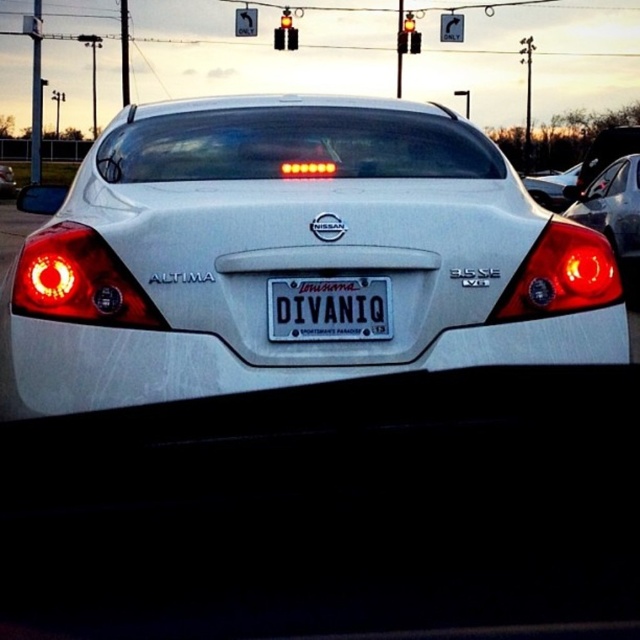
Question: Considering the real-world distances, which object is closest to the satin black sedan at center?

Choices:
 (A) matte plastic brake light at right
 (B) white plastic license plate at center
 (C) matte red brake light at left
 (D) satin silver sedan at center

Answer: (A)

Question: Does matte plastic brake light at center appear over red glass traffic light at center?

Choices:
 (A) yes
 (B) no

Answer: (B)

Question: Which object appears closest to the camera in this image?

Choices:
 (A) satin silver sedan at center
 (B) white plastic license plate at center
 (C) matte plastic brake light at center
 (D) red glass traffic light at upper center

Answer: (B)

Question: Observing the image, what is the correct spatial positioning of matte plastic brake light at center in reference to satin black sedan at center?

Choices:
 (A) left
 (B) right

Answer: (A)

Question: In this image, where is matte plastic brake light at right located relative to red glass traffic light at upper center?

Choices:
 (A) left
 (B) right

Answer: (B)

Question: Estimate the real-world distances between objects in this image. Which object is closer to the satin silver sedan at right?

Choices:
 (A) matte plastic brake light at right
 (B) red glass traffic light at center
 (C) satin black sedan at center

Answer: (C)